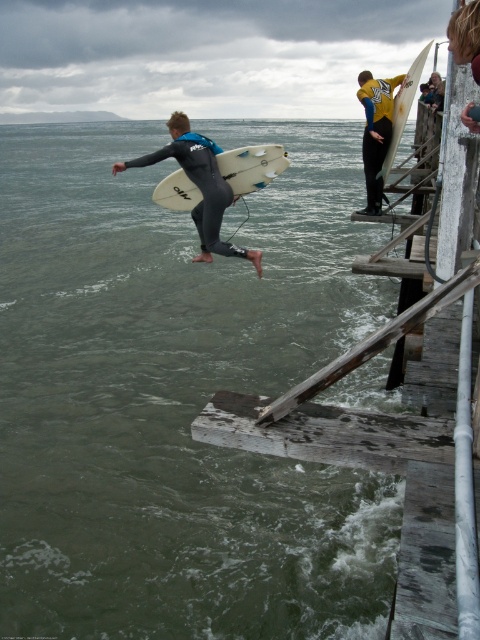
In the scene shown: You are a photographer trying to capture the perfect shot of the yellow matte wetsuit at upper right and the white glossy surfboard at upper right. Since you want to ensure both are visible in the frame, which object should you focus on to avoid cropping either?

The yellow matte wetsuit at upper right is narrower than the white glossy surfboard at upper right. To ensure both are visible without cropping, focus on the wider object, the white glossy surfboard at upper right, as it requires more space in the frame.

You are standing on the pier and want to locate two specific points marked in the image. Which of the two points, point 1 at coordinates point (243, 154) or point 2 at coordinates point (400, 81), is closer to you?

Point 1 at coordinates point (243, 154) is closer to you than point 2 at coordinates point (400, 81).